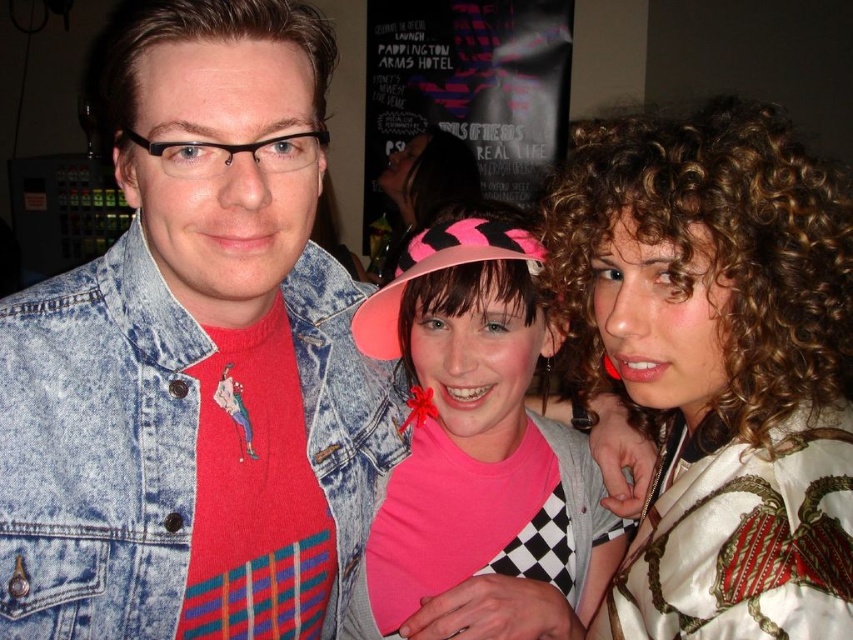
Looking at this image, you are a photographer at the event and need to adjust the camera focus. The camera can only focus on objects within a 50 cm range. Are the two people closest to the white satin blouse at center within the focus range?

The two people closest to the white satin blouse at center are 52.41 centimeters apart, which exceeds the camera focus range of 50 cm. Therefore, they are slightly out of focus.

You are a photographer at the event and want to capture a clear shot of both the pink matte hat at center and the silky white robe with red and gold patterns at right. Which object should you focus on first to ensure both are in focus?

You should focus on the pink matte hat at center first since it is closer to the viewer than the silky white robe with red and gold patterns at right. By focusing on the closer object, the depth of field may allow both to be in focus.

You are a photographer trying to capture a candid shot of the faded denim jacket at upper left and the pink fabric hat at center. Your camera has a maximum focus range of 5 feet. Will you be able to capture both subjects in focus without moving your position?

The distance between the faded denim jacket at upper left and the pink fabric hat at center is 5.68 feet, which exceeds the camera maximum focus range of 5 feet. Therefore, you cannot capture both subjects in focus without moving your position.